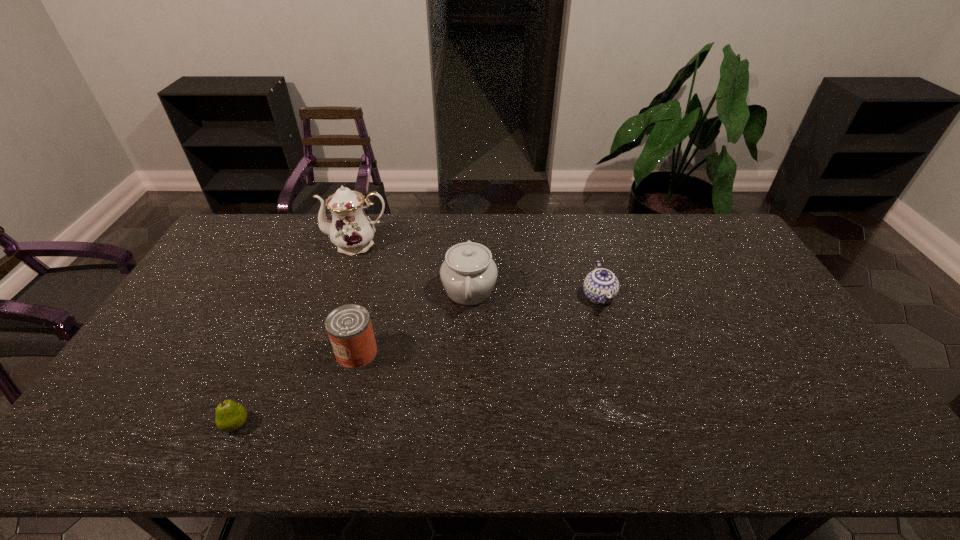
The image size is (960, 540). What are the coordinates of `object that can be found as the second closest to the rightmost object` in the screenshot? It's located at (349, 328).

Identify which chinaware is located as the nearest to the third tallest object. Please provide its 2D coordinates. Your answer should be formatted as a tuple, i.e. [(x, y)], where the tuple contains the x and y coordinates of a point satisfying the conditions above.

[(468, 274)]

Identify which chinaware is located as the nearest to the rightmost object. Please provide its 2D coordinates. Your answer should be formatted as a tuple, i.e. [(x, y)], where the tuple contains the x and y coordinates of a point satisfying the conditions above.

[(468, 274)]

Image resolution: width=960 pixels, height=540 pixels. Identify the location of free space that satisfies the following two spatial constraints: 1. on the back side of the can; 2. on the left side of the second tallest object. (373, 291).

Locate an element on the screen. blank area in the image that satisfies the following two spatial constraints: 1. on the front side of the can; 2. on the left side of the farthest chinaware is located at coordinates (322, 354).